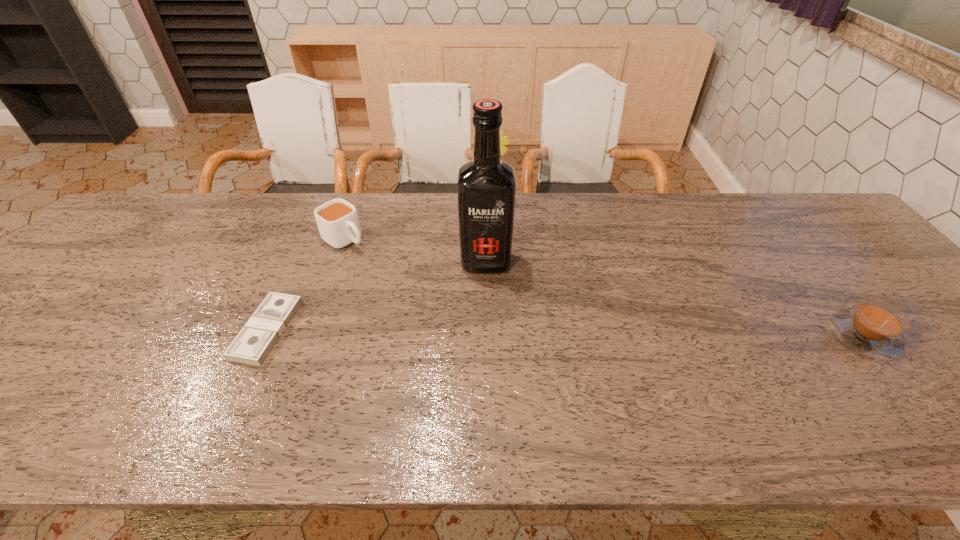
Find the location of a particular element. The height and width of the screenshot is (540, 960). blank area located on the front-facing side of the second tallest object is located at coordinates (505, 233).

Identify the location of vacant space located 0.250m on the front-facing side of the second tallest object. The width and height of the screenshot is (960, 540). [516, 262].

This screenshot has width=960, height=540. I want to click on vacant space located on the front-facing side of the tallest object, so click(x=486, y=300).

I want to click on vacant space located 0.290m on the front-facing side of the tallest object, so click(x=486, y=367).

Image resolution: width=960 pixels, height=540 pixels. I want to click on vacant area situated 0.160m on the front-facing side of the tallest object, so click(486, 321).

Find the location of `free space located 0.170m on the side with the handle of the cup`. free space located 0.170m on the side with the handle of the cup is located at coordinates (398, 276).

This screenshot has height=540, width=960. I want to click on vacant space positioned on the side with the handle of the cup, so click(445, 310).

Find the location of a particular element. The image size is (960, 540). vacant space located 0.240m on the side with the handle of the cup is located at coordinates (416, 289).

At what (x,y) coordinates should I click in order to perform the action: click on sunflower that is at the far edge. Please return your answer as a coordinate pair (x, y). The height and width of the screenshot is (540, 960). Looking at the image, I should click on click(503, 141).

You are a GUI agent. You are given a task and a screenshot of the screen. Output one action in this format:
    pyautogui.click(x=<x>, y=<y>)
    Task: Click on the cup that is at the far edge
    
    Given the screenshot: What is the action you would take?
    pyautogui.click(x=337, y=220)